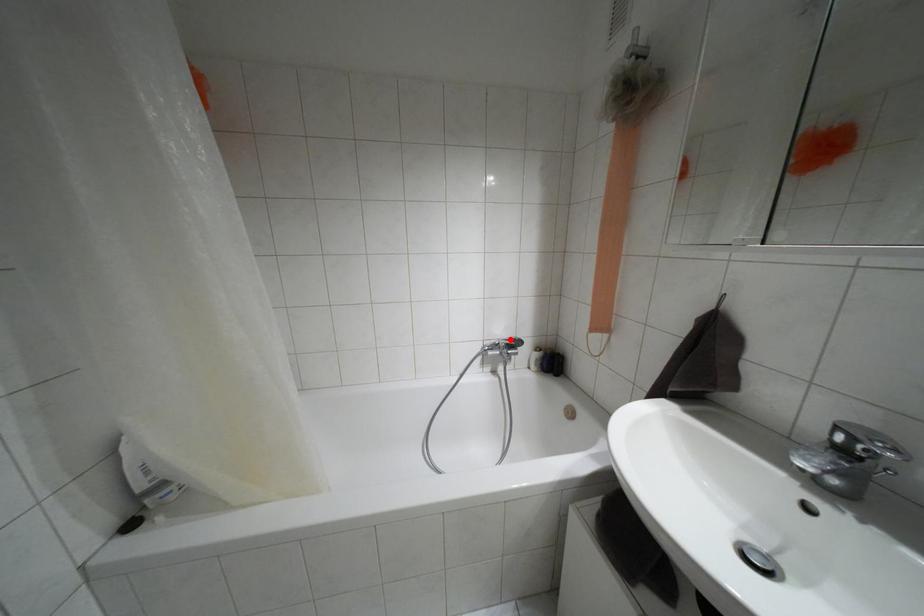
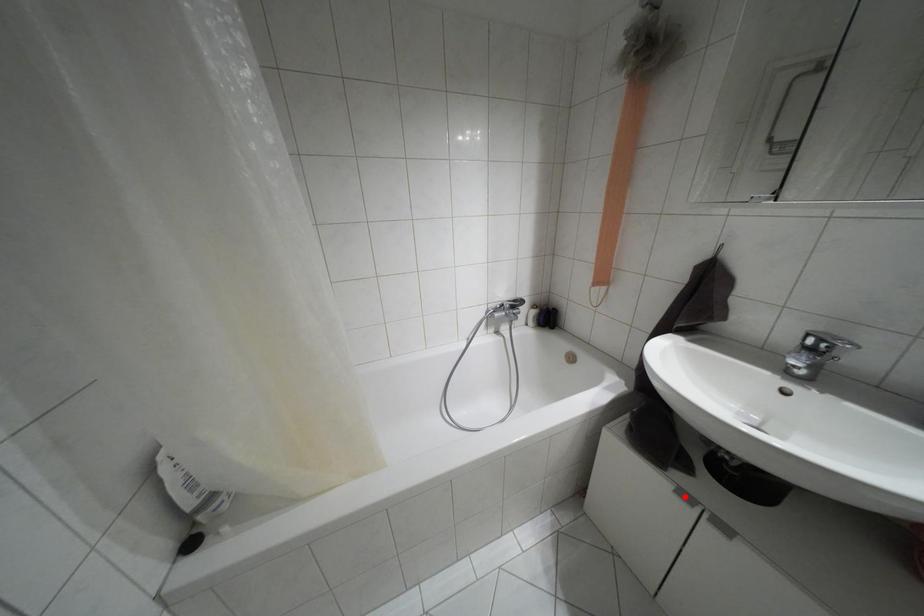
Consider the image. I am providing you with two images of the same scene from different viewpoints. A red point is marked on the first image and another point is marked on the second image. Are the points marked in image1 and image2 representing the same 3D position?

No